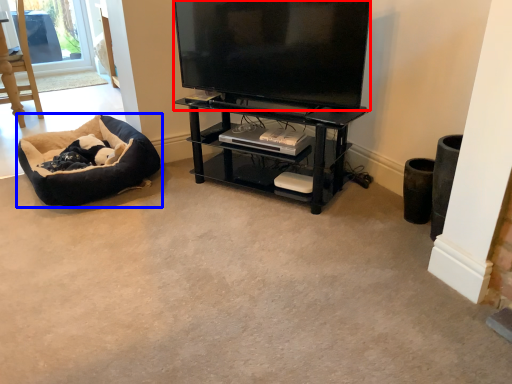
Question: Among these objects, which one is farthest to the camera, television (highlighted by a red box) or dog bed (highlighted by a blue box)?

Choices:
 (A) television
 (B) dog bed

Answer: (B)